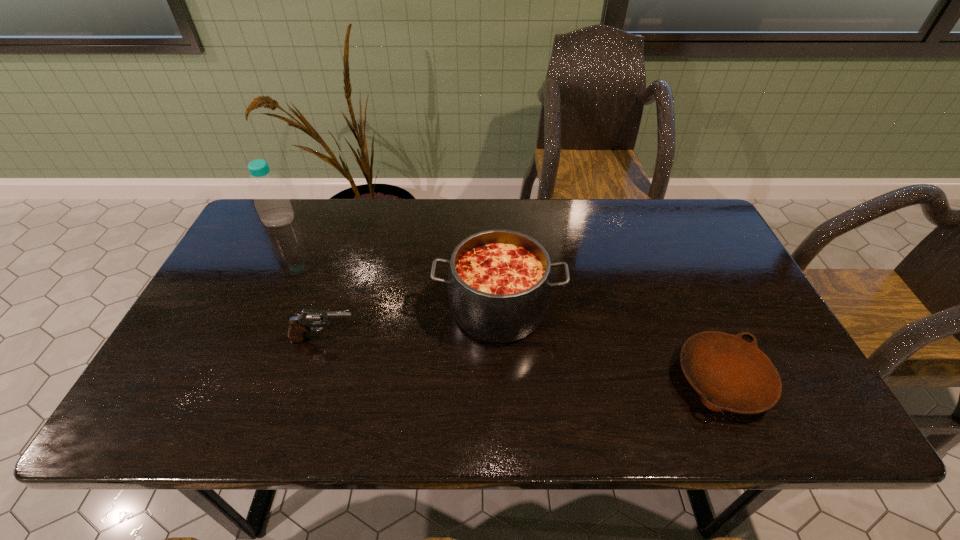
Where is `the farthest object`? The height and width of the screenshot is (540, 960). the farthest object is located at coordinates (272, 203).

Locate an element on the screen. the leftmost object is located at coordinates (272, 203).

At what (x,y) coordinates should I click in order to perform the action: click on the second object from right to left. Please return your answer as a coordinate pair (x, y). Looking at the image, I should click on (499, 283).

Locate an element on the screen. This screenshot has height=540, width=960. casserole is located at coordinates (499, 283).

Locate an element on the screen. The height and width of the screenshot is (540, 960). the second shortest object is located at coordinates pyautogui.click(x=299, y=325).

At what (x,y) coordinates should I click in order to perform the action: click on pistol. Please return your answer as a coordinate pair (x, y). Image resolution: width=960 pixels, height=540 pixels. Looking at the image, I should click on (299, 325).

You are a GUI agent. You are given a task and a screenshot of the screen. Output one action in this format:
    pyautogui.click(x=<x>, y=<y>)
    Task: Click on the shortest object
    This screenshot has height=540, width=960.
    Given the screenshot: What is the action you would take?
    pyautogui.click(x=730, y=374)

This screenshot has width=960, height=540. Find the location of `the rightmost object`. the rightmost object is located at coordinates 730,374.

The width and height of the screenshot is (960, 540). Identify the location of free space located 0.320m on the right of the second object from right to left. (685, 309).

Locate an element on the screen. free space located 0.110m at the barrel of the pistol is located at coordinates (404, 339).